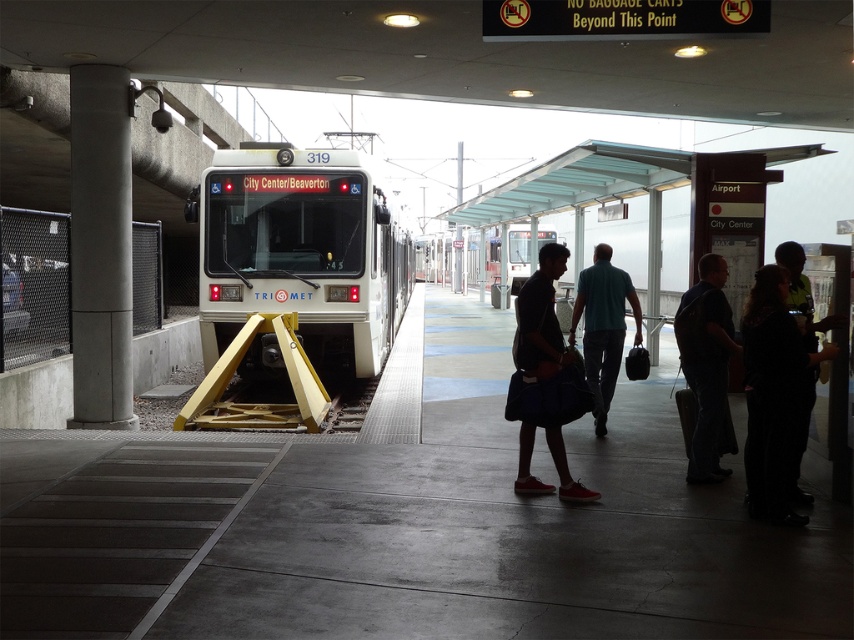
Question: Considering the relative positions of white glossy train at center and dark blue fabric bag at center in the image provided, where is white glossy train at center located with respect to dark blue fabric bag at center?

Choices:
 (A) left
 (B) right

Answer: (A)

Question: Does concrete column at left appear on the right side of black fabric at right?

Choices:
 (A) yes
 (B) no

Answer: (B)

Question: Considering the real-world distances, which object is farthest from the black fabric at right?

Choices:
 (A) dark blue jeans at center
 (B) teal fabric shirt at center
 (C) concrete column at left

Answer: (C)

Question: Is black fabric at right thinner than dark blue fabric bag at center?

Choices:
 (A) yes
 (B) no

Answer: (A)

Question: Which point is closer to the camera taking this photo?

Choices:
 (A) (763, 472)
 (B) (613, 369)
 (C) (291, 288)

Answer: (A)

Question: Which point appears closest to the camera in this image?

Choices:
 (A) (764, 275)
 (B) (588, 288)
 (C) (352, 168)
 (D) (80, 381)

Answer: (A)